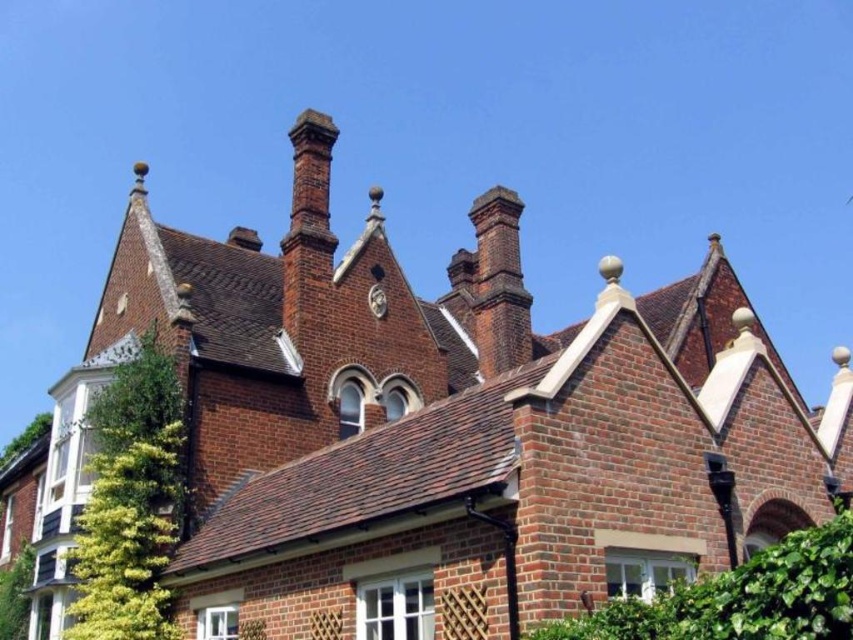
You are a gardener planning to trim the green leafy ivy at left and the green leafy hedge at lower right. Which of these two plants requires more space for maintenance due to their size?

The green leafy hedge at lower right requires more space for maintenance because it has a greater width than the green leafy ivy at left.

You are standing at a point 104 feet away from the building. You want to take a photo of the building with your camera. Is the point marked as point (625, 605) on the building within the camera frame if the camera has a 50mm lens and a 46 degree field of view?

The point marked as point (625, 605) is 104 feet away from the camera. With a 50mm lens and a 46 degree field of view, the camera can capture objects within a certain angle. To determine if the point is within the frame, calculate the maximum distance the camera can capture at 46 degrees. Since the point is exactly at the calculated distance, it will be on the edge of the frame.